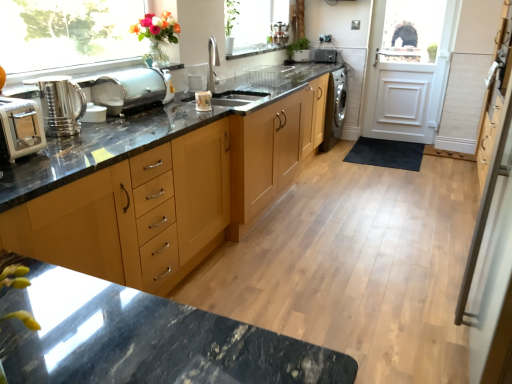
Question: Is silver metallic screen door at right positioned before light wood cabinet at center?

Choices:
 (A) no
 (B) yes

Answer: (B)

Question: From the image's perspective, would you say silver metallic screen door at right is shown under light wood cabinet at center?

Choices:
 (A) yes
 (B) no

Answer: (A)

Question: Does silver metallic screen door at right have a greater width compared to light wood cabinet at center?

Choices:
 (A) no
 (B) yes

Answer: (A)

Question: Would you say silver metallic screen door at right is a long distance from light wood cabinet at center?

Choices:
 (A) no
 (B) yes

Answer: (B)

Question: Considering the relative sizes of silver metallic screen door at right and light wood cabinet at center in the image provided, is silver metallic screen door at right taller than light wood cabinet at center?

Choices:
 (A) yes
 (B) no

Answer: (A)

Question: In the image, is glossy ceramic mug at upper center, the second appliance in the left-to-right sequence, positioned in front of or behind white wooden door at upper right?

Choices:
 (A) front
 (B) behind

Answer: (A)

Question: Considering the positions of point (202, 96) and point (377, 87), is point (202, 96) closer or farther from the camera than point (377, 87)?

Choices:
 (A) closer
 (B) farther

Answer: (A)

Question: In the image, is glossy ceramic mug at upper center, which ranks as the 2th appliance in right-to-left order, on the left side or the right side of white wooden door at upper right?

Choices:
 (A) right
 (B) left

Answer: (B)

Question: From a real-world perspective, is glossy ceramic mug at upper center, marked as the second appliance in a front-to-back arrangement, above or below white wooden door at upper right?

Choices:
 (A) above
 (B) below

Answer: (A)

Question: From a real-world perspective, is clear glass window at upper left positioned above or below glossy ceramic mug at upper center, which is counted as the third appliance, starting from the top?

Choices:
 (A) below
 (B) above

Answer: (B)

Question: From the image's perspective, is clear glass window at upper left located above or below glossy ceramic mug at upper center, the second appliance in the left-to-right sequence?

Choices:
 (A) below
 (B) above

Answer: (B)

Question: Is clear glass window at upper left inside the boundaries of glossy ceramic mug at upper center, marked as the second appliance in a front-to-back arrangement, or outside?

Choices:
 (A) outside
 (B) inside

Answer: (A)

Question: In terms of height, does clear glass window at upper left look taller or shorter compared to glossy ceramic mug at upper center, the first appliance ordered from the bottom?

Choices:
 (A) tall
 (B) short

Answer: (A)

Question: Is point (57, 91) positioned closer to the camera than point (501, 375)?

Choices:
 (A) closer
 (B) farther

Answer: (B)

Question: In the image, is shiny metallic kettle at left on the left side or the right side of silver metallic screen door at right?

Choices:
 (A) left
 (B) right

Answer: (A)